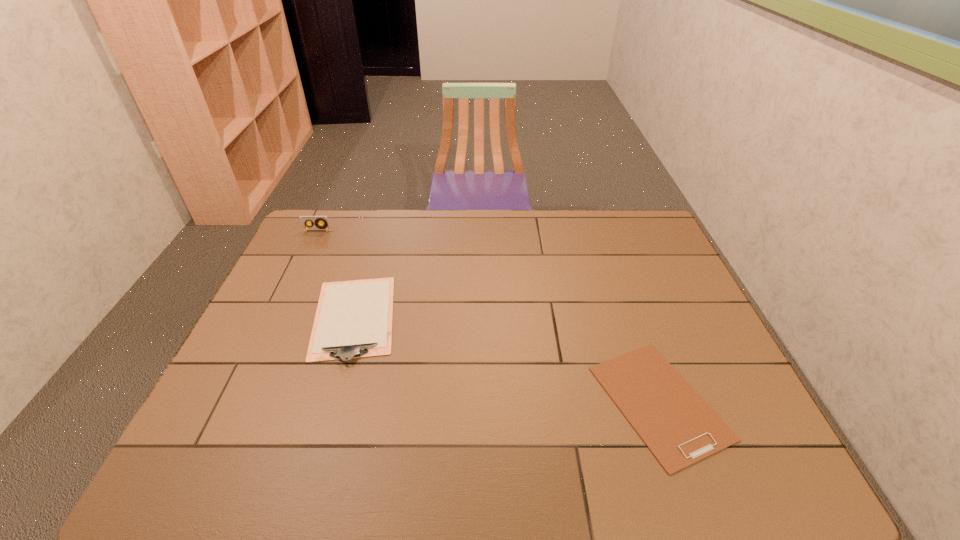
Find the location of `vacant space that satisfies the following two spatial constraints: 1. at the front of the videotape with visible reels; 2. on the right side of the left clipboard`. vacant space that satisfies the following two spatial constraints: 1. at the front of the videotape with visible reels; 2. on the right side of the left clipboard is located at coordinates (276, 318).

This screenshot has height=540, width=960. I want to click on free space in the image that satisfies the following two spatial constraints: 1. at the front of the farthest object with visible reels; 2. on the left side of the right clipboard, so click(235, 402).

In order to click on free space that satisfies the following two spatial constraints: 1. at the front of the leftmost object with visible reels; 2. on the left side of the rightmost object in this screenshot , I will do `click(235, 402)`.

This screenshot has height=540, width=960. Find the location of `vacant region that satisfies the following two spatial constraints: 1. at the front of the right clipboard with visible reels; 2. on the right side of the farthest object`. vacant region that satisfies the following two spatial constraints: 1. at the front of the right clipboard with visible reels; 2. on the right side of the farthest object is located at coordinates (235, 402).